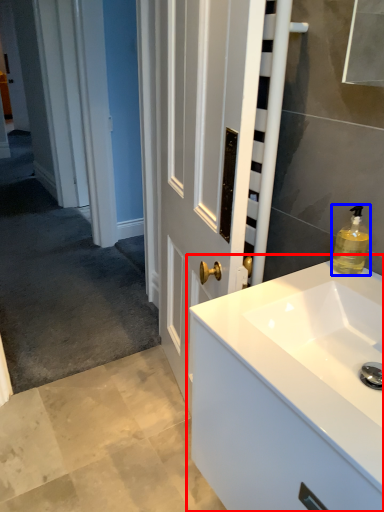
Question: Which object is further to the camera taking this photo, bathroom cabinet (highlighted by a red box) or soap dispenser (highlighted by a blue box)?

Choices:
 (A) bathroom cabinet
 (B) soap dispenser

Answer: (B)